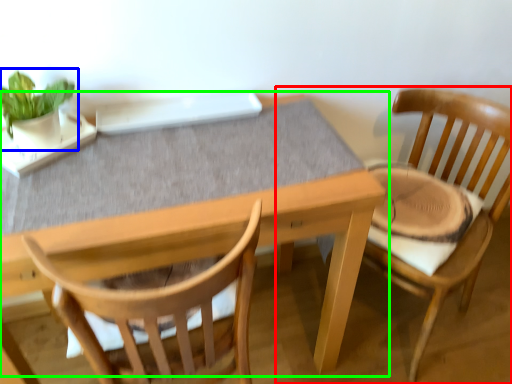
Question: Based on their relative distances, which object is farther from chair (highlighted by a red box)? Choose from houseplant (highlighted by a blue box) and table (highlighted by a green box).

Choices:
 (A) houseplant
 (B) table

Answer: (A)